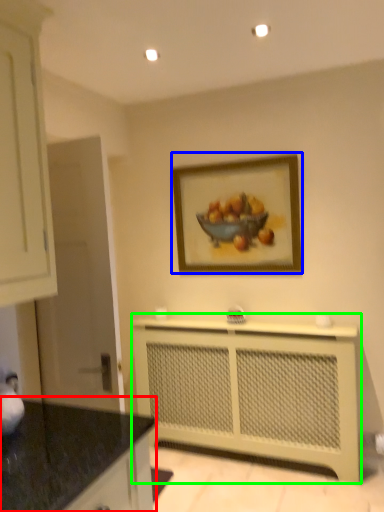
Question: Which is nearer to the countertop (highlighted by a red box)? picture frame (highlighted by a blue box) or counter (highlighted by a green box).

Choices:
 (A) picture frame
 (B) counter

Answer: (B)